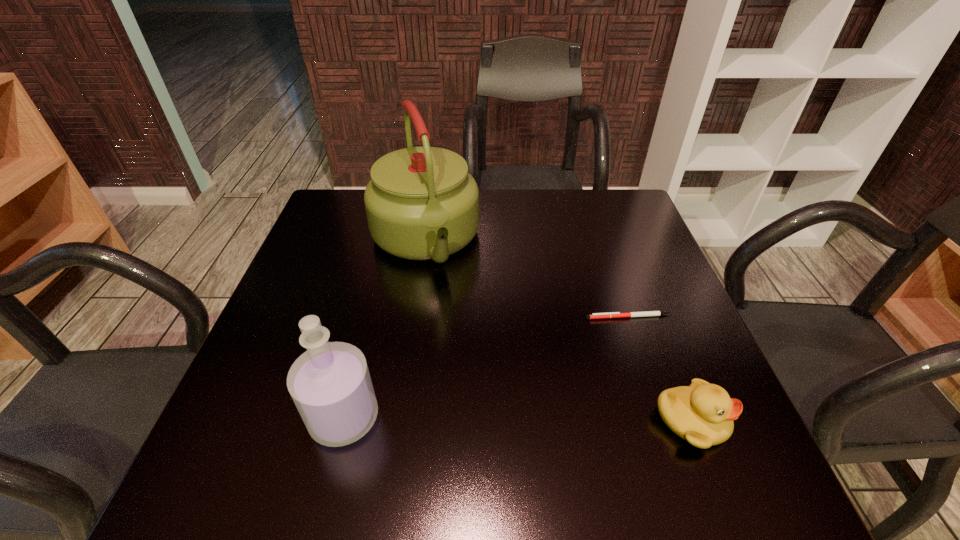
Identify the location of object that stands as the third closest to the kettle. The image size is (960, 540). (702, 414).

Identify which object is located as the third nearest to the tallest object. Please provide its 2D coordinates. Your answer should be formatted as a tuple, i.e. [(x, y)], where the tuple contains the x and y coordinates of a point satisfying the conditions above.

[(702, 414)]

Identify the location of vacant space that satisfies the following two spatial constraints: 1. on the front side of the farthest object; 2. on the front-facing side of the duckling. (396, 421).

The image size is (960, 540). In order to click on vacant area in the image that satisfies the following two spatial constraints: 1. on the back side of the pen; 2. on the right side of the perfume in this screenshot , I will do `click(370, 317)`.